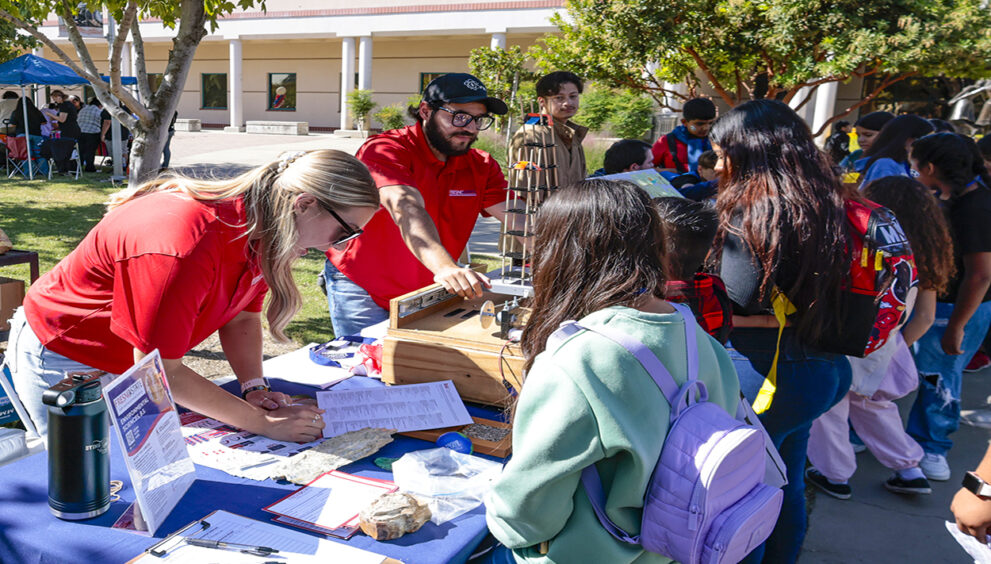
The width and height of the screenshot is (991, 564). What are the coordinates of `table` in the screenshot? It's located at (442, 548).